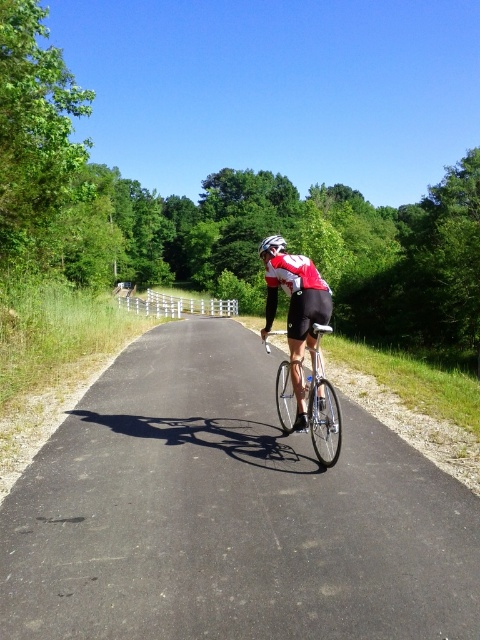
Measure the distance between silver metallic bicycle at center and camera.

14.89 feet

Who is more distant from viewer, (337, 445) or (261, 250)?

The point (261, 250) is behind.

This screenshot has width=480, height=640. Identify the location of silver metallic bicycle at center. click(323, 408).

Is shiny silver bicycle at center to the left of white matte bicycle helmet at center from the viewer's perspective?

Indeed, shiny silver bicycle at center is positioned on the left side of white matte bicycle helmet at center.

Which of these two, shiny silver bicycle at center or white matte bicycle helmet at center, stands taller?

With more height is white matte bicycle helmet at center.

Is point (308, 285) in front of point (263, 241)?

That is True.

Where is `shiny silver bicycle at center`? The height and width of the screenshot is (640, 480). shiny silver bicycle at center is located at coordinates (302, 348).

Is shiny silver bicycle at center shorter than silver metallic bicycle at center?

In fact, shiny silver bicycle at center may be taller than silver metallic bicycle at center.

Identify the location of shiny silver bicycle at center. (302, 348).

This screenshot has height=640, width=480. Identify the location of shiny silver bicycle at center. (302, 348).